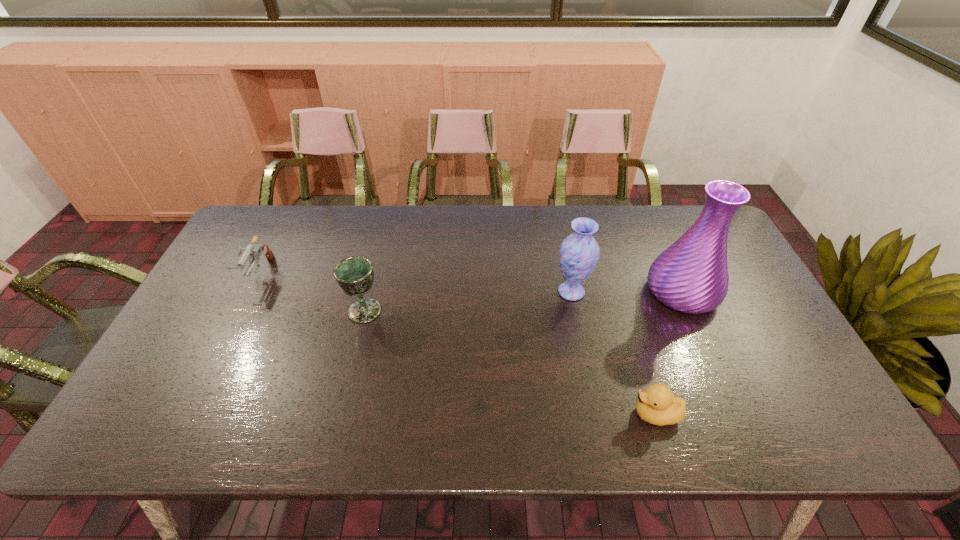
Locate an element on the screen. free space at the near edge of the desktop is located at coordinates (596, 416).

The image size is (960, 540). Find the location of `vacant space at the right edge of the desktop`. vacant space at the right edge of the desktop is located at coordinates (751, 315).

Identify the location of free point at the far left corner. This screenshot has height=540, width=960. (273, 208).

At what (x,y) coordinates should I click in order to perform the action: click on vacant point located between the fourth object from left to right and the shorter vase. Please return your answer as a coordinate pair (x, y). Looking at the image, I should click on (613, 353).

Identify the location of blank region between the second tallest object and the chalice. (468, 301).

Find the location of a particular element. This screenshot has height=540, width=960. empty space between the chalice and the fourth shortest object is located at coordinates (468, 301).

Find the location of `vacant area that lies between the shorter vase and the duckling`. vacant area that lies between the shorter vase and the duckling is located at coordinates (613, 353).

Locate an element on the screen. unoccupied area between the shorter vase and the gun is located at coordinates (415, 282).

Where is `free space between the nearest object and the rightmost object`? Image resolution: width=960 pixels, height=540 pixels. free space between the nearest object and the rightmost object is located at coordinates (669, 353).

I want to click on free area in between the right vase and the duckling, so click(x=669, y=353).